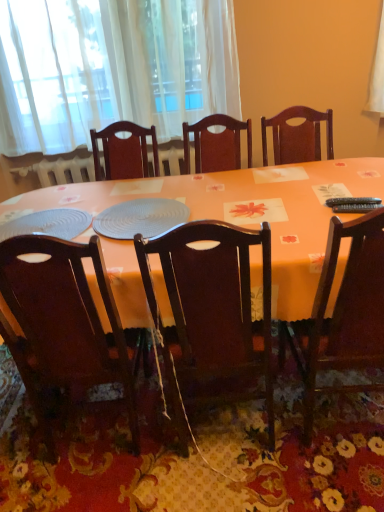
Question: From a real-world perspective, is white sheer curtain at upper left positioned under black plastic remote control at right, which is counted as the 2th remote control, starting from the top, based on gravity?

Choices:
 (A) yes
 (B) no

Answer: (B)

Question: From a real-world perspective, is white sheer curtain at upper left on black plastic remote control at right, which is counted as the 2th remote control, starting from the top?

Choices:
 (A) no
 (B) yes

Answer: (B)

Question: Does white sheer curtain at upper left come behind black plastic remote control at right, which is counted as the 2th remote control, starting from the top?

Choices:
 (A) yes
 (B) no

Answer: (A)

Question: Is white sheer curtain at upper left turned away from black plastic remote control at right, which appears as the 1th remote control when ordered from the bottom?

Choices:
 (A) yes
 (B) no

Answer: (B)

Question: Is white sheer curtain at upper left smaller than black plastic remote control at right, which appears as the 1th remote control when ordered from the bottom?

Choices:
 (A) no
 (B) yes

Answer: (A)

Question: Is white sheer curtain at upper left shorter than black plastic remote control at right, which appears as the 1th remote control when ordered from the bottom?

Choices:
 (A) no
 (B) yes

Answer: (A)

Question: Considering the relative positions of wooden chair at right, which is the first chair in right-to-left order, and white sheer curtain at upper left in the image provided, is wooden chair at right, which is the first chair in right-to-left order, behind white sheer curtain at upper left?

Choices:
 (A) no
 (B) yes

Answer: (A)

Question: Is wooden chair at right, the 3th chair in the left-to-right sequence, shorter than white sheer curtain at upper left?

Choices:
 (A) no
 (B) yes

Answer: (A)

Question: Considering the relative sizes of wooden chair at right, which is the first chair in right-to-left order, and white sheer curtain at upper left in the image provided, is wooden chair at right, which is the first chair in right-to-left order, taller than white sheer curtain at upper left?

Choices:
 (A) no
 (B) yes

Answer: (B)

Question: Can white sheer curtain at upper left be found inside wooden chair at right, the 3th chair in the left-to-right sequence?

Choices:
 (A) yes
 (B) no

Answer: (B)

Question: Can you see wooden chair at right, which is the first chair in right-to-left order, touching white sheer curtain at upper left?

Choices:
 (A) no
 (B) yes

Answer: (A)

Question: Is wooden chair at right, the 3th chair in the left-to-right sequence, closer to the viewer compared to white sheer curtain at upper left?

Choices:
 (A) no
 (B) yes

Answer: (B)

Question: Is orange fabric table at center completely or partially outside of wooden chair at right, which is the first chair in right-to-left order?

Choices:
 (A) yes
 (B) no

Answer: (A)